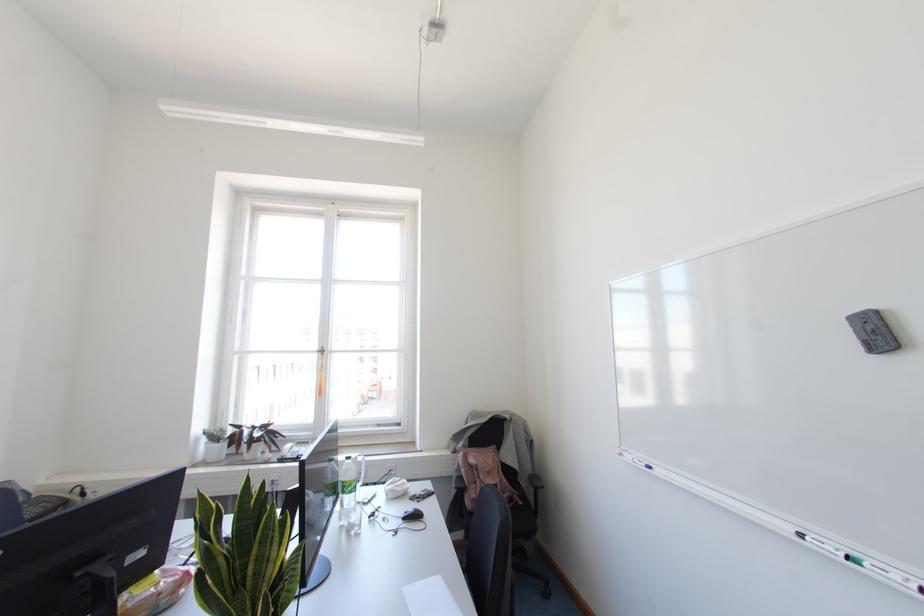
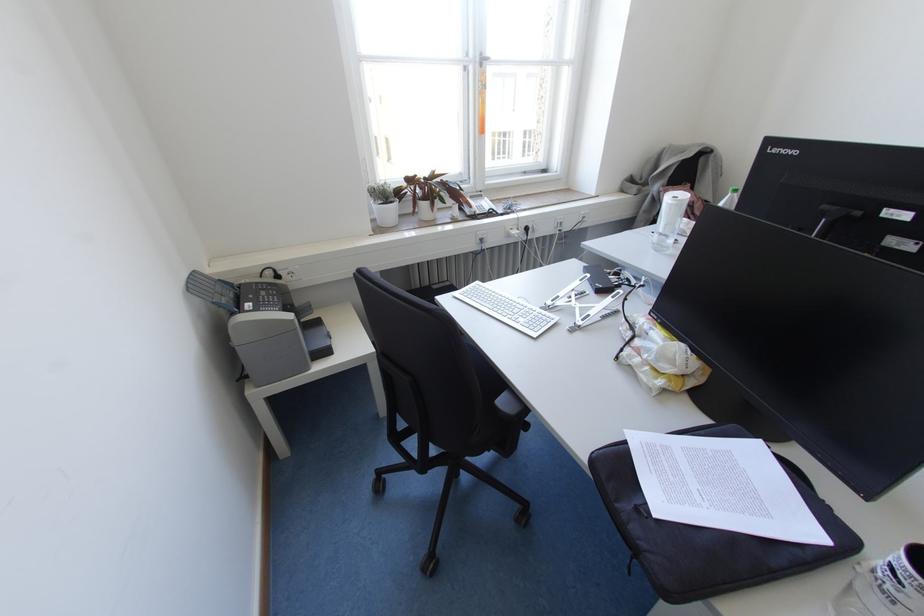
In the second image, find the point that corresponds to point (223, 431) in the first image.

(390, 187)